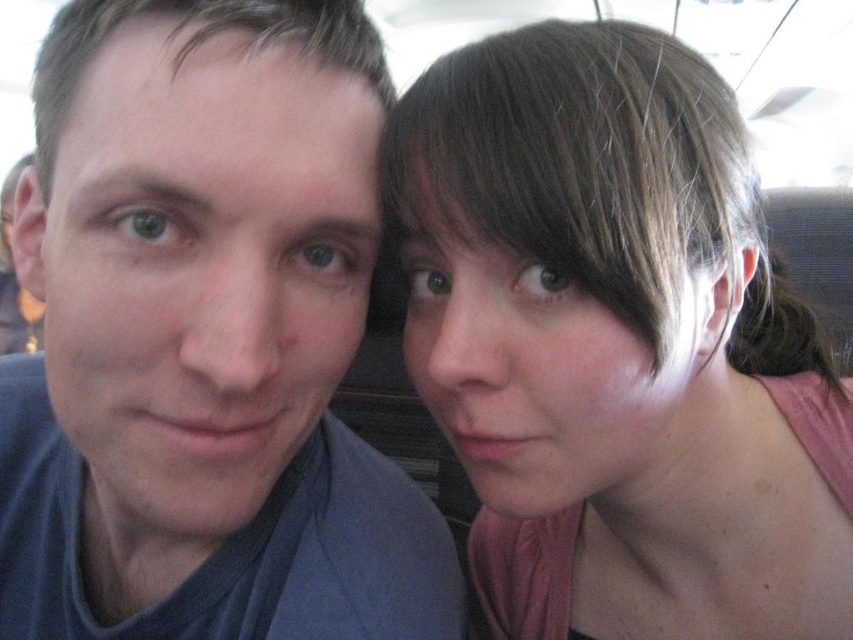
What do you see at coordinates (206, 339) in the screenshot?
I see `blue matte shirt at left` at bounding box center [206, 339].

Can you confirm if blue matte shirt at left is shorter than pink fabric at upper right?

Indeed, blue matte shirt at left has a lesser height compared to pink fabric at upper right.

Is point (364, 108) in front of point (622, 602)?

Yes.

Locate an element on the screen. The image size is (853, 640). blue matte shirt at left is located at coordinates (206, 339).